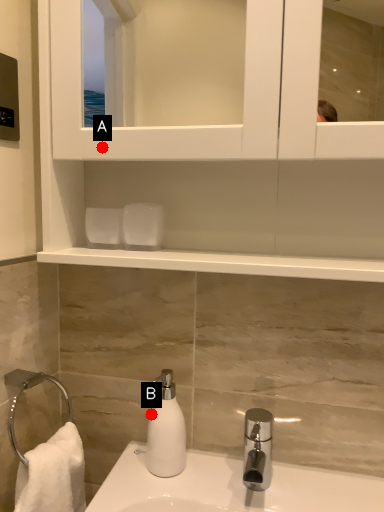
Question: Two points are circled on the image, labeled by A and B beside each circle. Which point is closer to the camera taking this photo?

Choices:
 (A) A is closer
 (B) B is closer

Answer: (A)